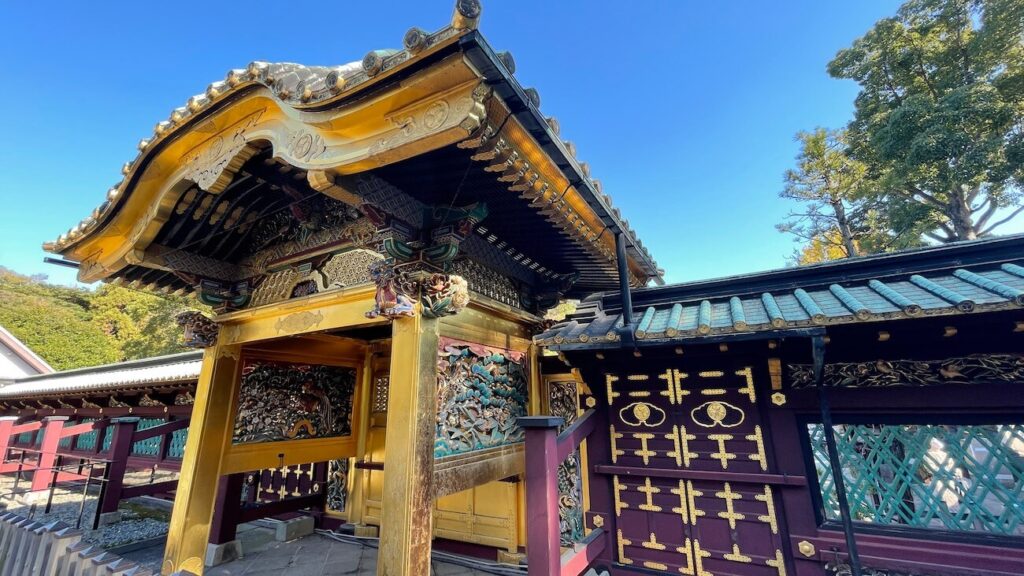
Find the location of `maroon support beam`. maroon support beam is located at coordinates (577, 560), (568, 442), (152, 431), (135, 491), (72, 472), (69, 428), (27, 427), (8, 465).